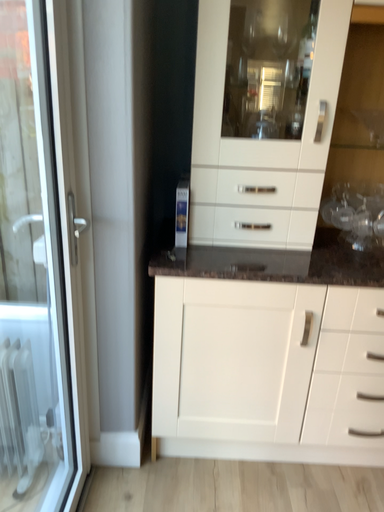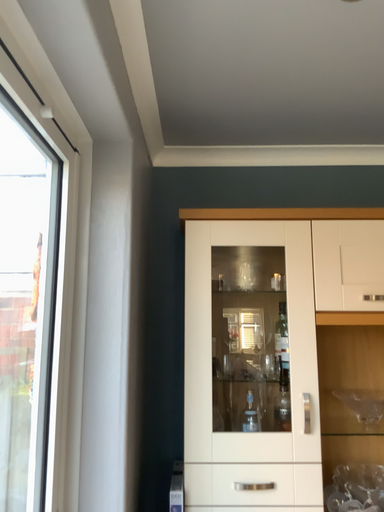
Question: How did the camera likely rotate when shooting the video?

Choices:
 (A) rotated upward
 (B) rotated downward

Answer: (A)